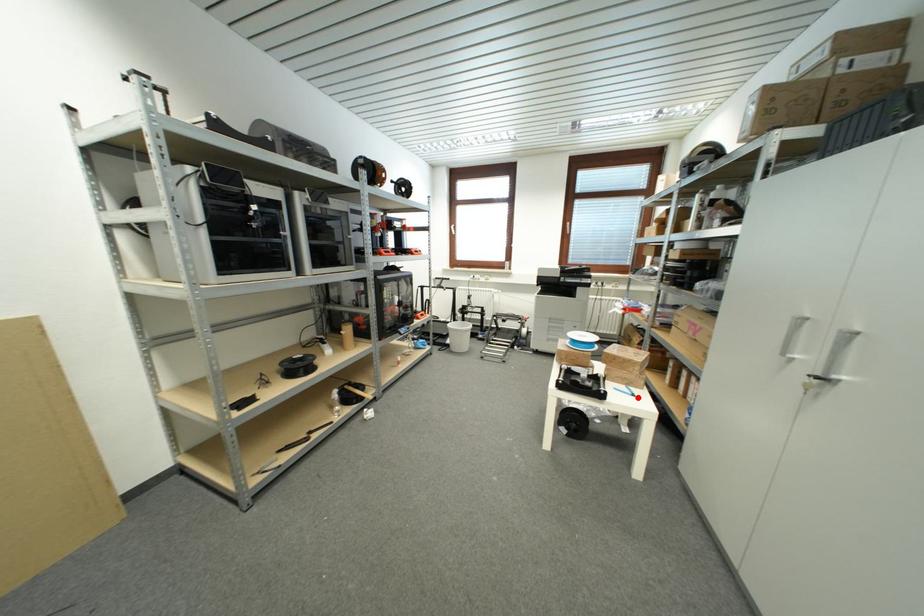
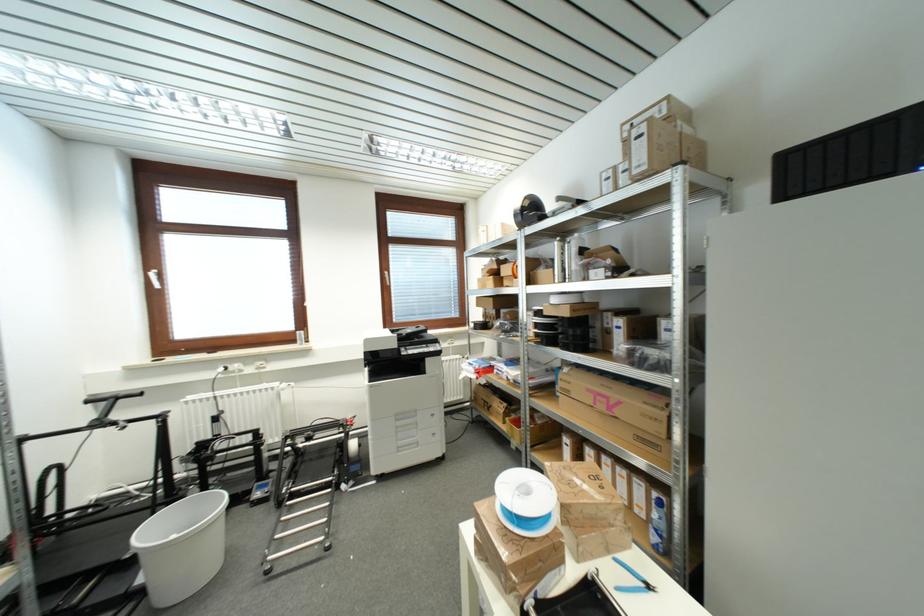
Find the pixel in the second image that matches the highlighted location in the first image.

(652, 590)